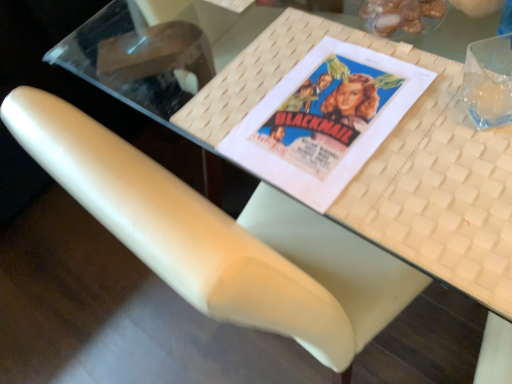
This screenshot has height=384, width=512. I want to click on empty space that is ontop of matte paper movie poster at center, so click(x=327, y=107).